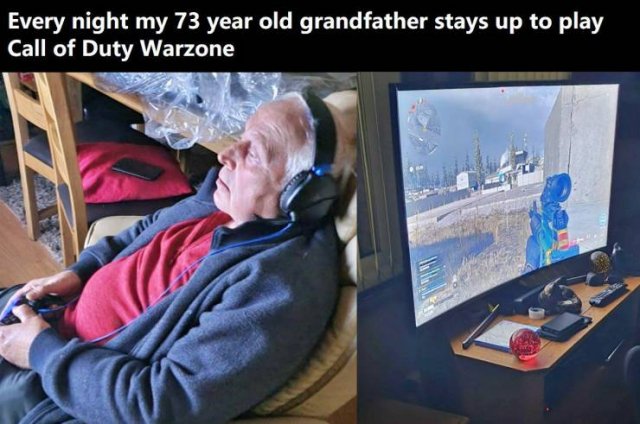
The image size is (640, 424). What are the coordinates of `phone` in the screenshot? It's located at (146, 168).